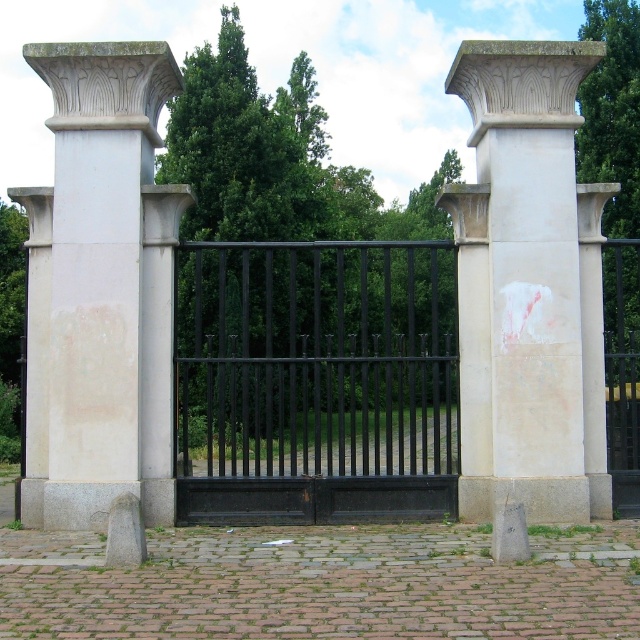
You are standing in front of the pillars and gate. You notice two points marked on the image. One is at coordinate point (x=320, y=406) and the other at point (x=568, y=298). From your perspective, which point is closer to you?

Point (x=568, y=298) is closer to you because point (x=320, y=406) is behind it.